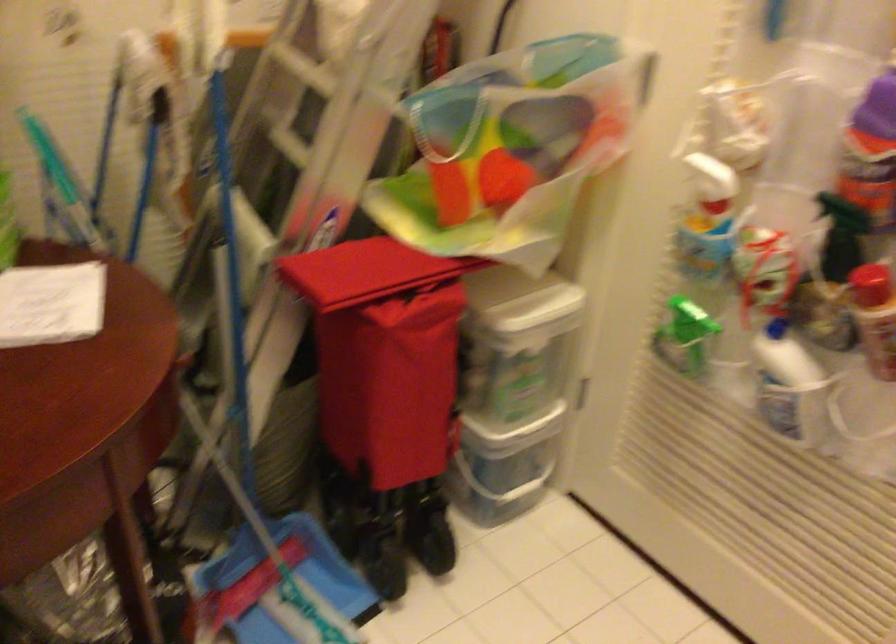
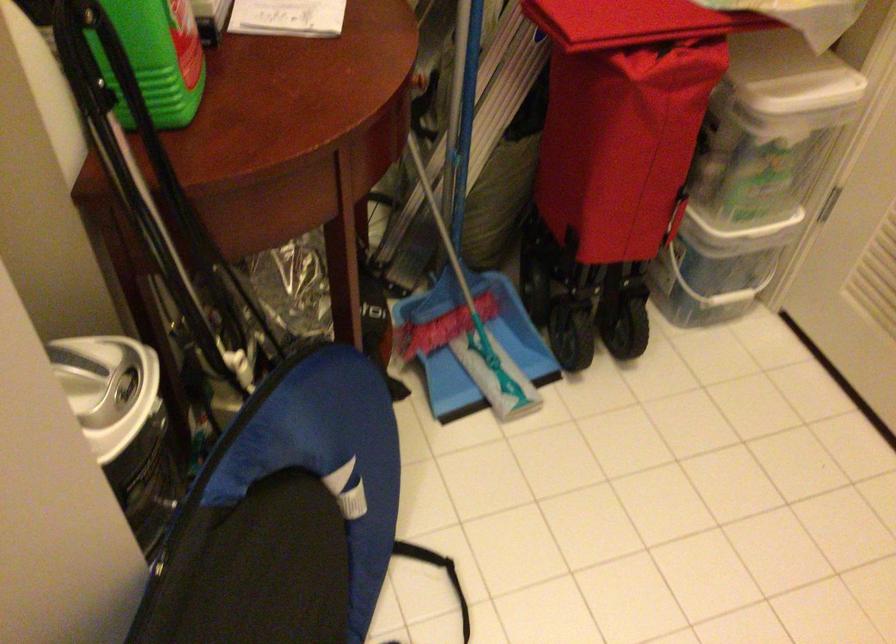
In the second image, find the point that corresponds to (x=512, y=384) in the first image.

(752, 174)